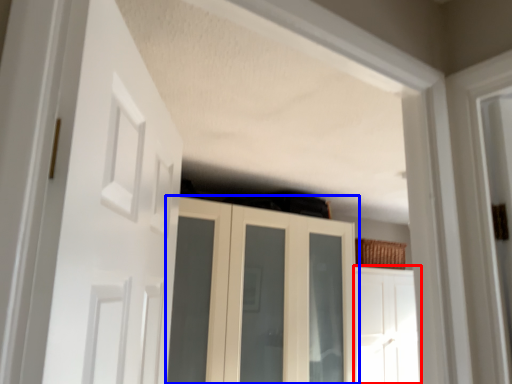
Question: Which object appears farthest to the camera in this image, door (highlighted by a red box) or cupboard (highlighted by a blue box)?

Choices:
 (A) door
 (B) cupboard

Answer: (A)